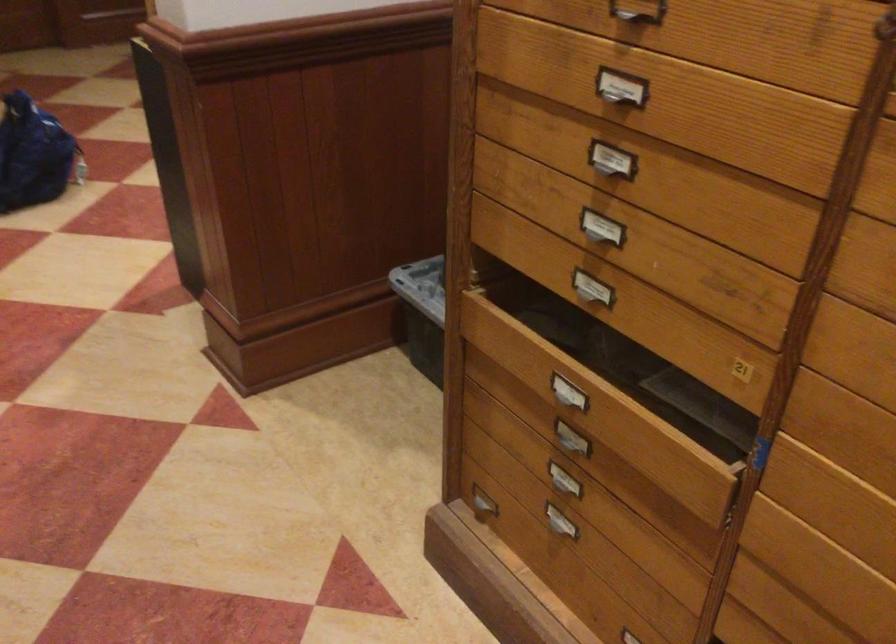
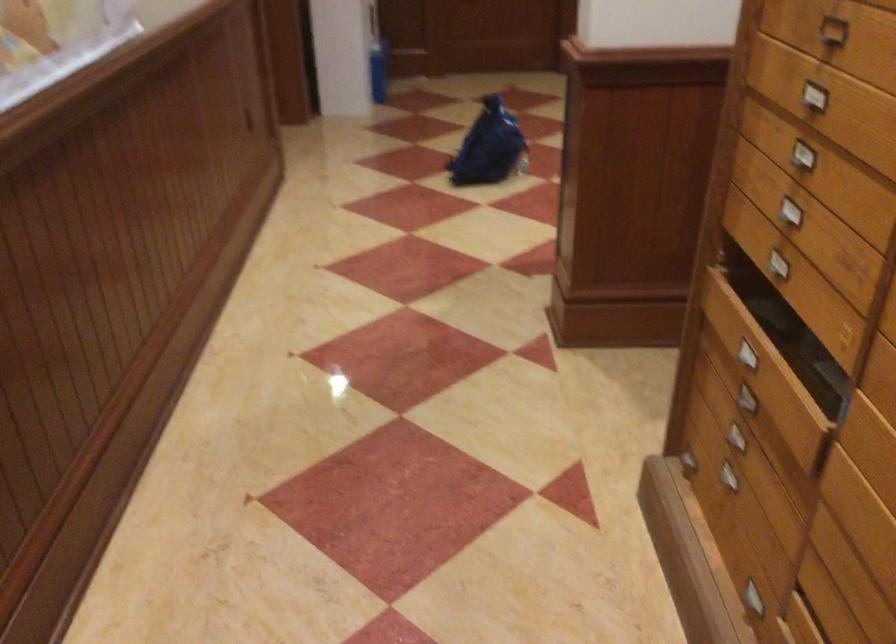
The point at (545, 520) is marked in the first image. Where is the corresponding point in the second image?

(725, 476)